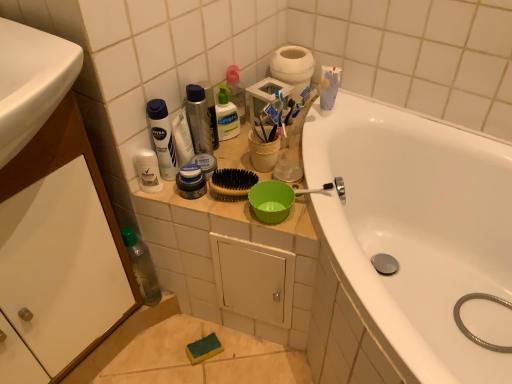
Question: From a real-world perspective, is white glossy bathtub at upper right physically below clear plastic bottle at upper center, which is the 3th cleaning product from left to right?

Choices:
 (A) yes
 (B) no

Answer: (A)

Question: From a real-world perspective, is white glossy bathtub at upper right located higher than clear plastic bottle at upper center, the 2th cleaning product in the right-to-left sequence?

Choices:
 (A) no
 (B) yes

Answer: (A)

Question: Considering the relative sizes of white glossy bathtub at upper right and clear plastic bottle at upper center, the 2th cleaning product in the right-to-left sequence, in the image provided, is white glossy bathtub at upper right taller than clear plastic bottle at upper center, the 2th cleaning product in the right-to-left sequence,?

Choices:
 (A) yes
 (B) no

Answer: (A)

Question: Can you confirm if white glossy bathtub at upper right is smaller than clear plastic bottle at upper center, the 2th cleaning product in the right-to-left sequence?

Choices:
 (A) yes
 (B) no

Answer: (B)

Question: From the image's perspective, is white glossy bathtub at upper right beneath clear plastic bottle at upper center, the 2th cleaning product in the right-to-left sequence?

Choices:
 (A) no
 (B) yes

Answer: (B)

Question: From the image's perspective, relative to metallic silver can at upper center, which appears as the second personal care when ordered from the bottom, is white glossy bathtub at upper right above or below?

Choices:
 (A) below
 (B) above

Answer: (A)

Question: In terms of height, does white glossy bathtub at upper right look taller or shorter compared to metallic silver can at upper center, which appears as the second personal care when ordered from the bottom?

Choices:
 (A) tall
 (B) short

Answer: (A)

Question: Looking at the image, does white glossy bathtub at upper right seem bigger or smaller compared to metallic silver can at upper center, the first personal care when ordered from top to bottom?

Choices:
 (A) big
 (B) small

Answer: (A)

Question: From a real-world perspective, is white glossy bathtub at upper right above or below metallic silver can at upper center, which appears as the second personal care when ordered from the bottom?

Choices:
 (A) above
 (B) below

Answer: (B)

Question: Is point (222, 114) positioned closer to the camera than point (151, 119)?

Choices:
 (A) closer
 (B) farther

Answer: (B)

Question: Do you think clear plastic bottle at upper center, the 2th cleaning product in the right-to-left sequence, is within white matte deodorant at upper center, the 1th cleaning product in the left-to-right sequence, or outside of it?

Choices:
 (A) inside
 (B) outside

Answer: (B)

Question: From a real-world perspective, relative to white matte deodorant at upper center, the 1th cleaning product in the left-to-right sequence, is clear plastic bottle at upper center, the 2th cleaning product in the right-to-left sequence, vertically above or below?

Choices:
 (A) above
 (B) below

Answer: (B)

Question: From the image's perspective, relative to white matte deodorant at upper center, the 1th cleaning product in the left-to-right sequence, is clear plastic bottle at upper center, the 2th cleaning product in the right-to-left sequence, above or below?

Choices:
 (A) above
 (B) below

Answer: (A)

Question: Visually, is white matte deodorant at upper center, the 1th cleaning product in the left-to-right sequence, positioned to the left or to the right of clear plastic bottle at upper center, which is the 3th cleaning product from left to right?

Choices:
 (A) right
 (B) left

Answer: (B)

Question: Is point (173, 150) positioned closer to the camera than point (223, 107)?

Choices:
 (A) farther
 (B) closer

Answer: (B)